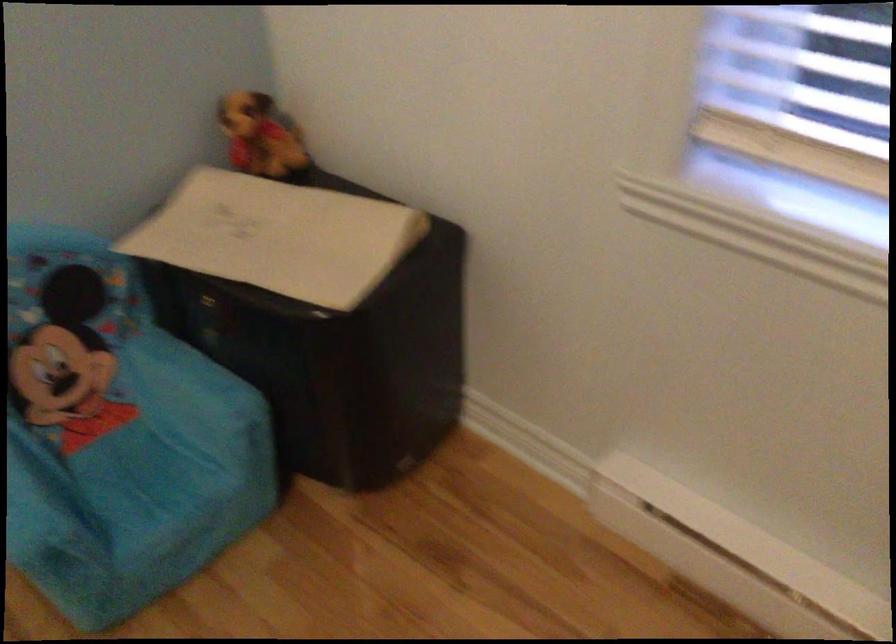
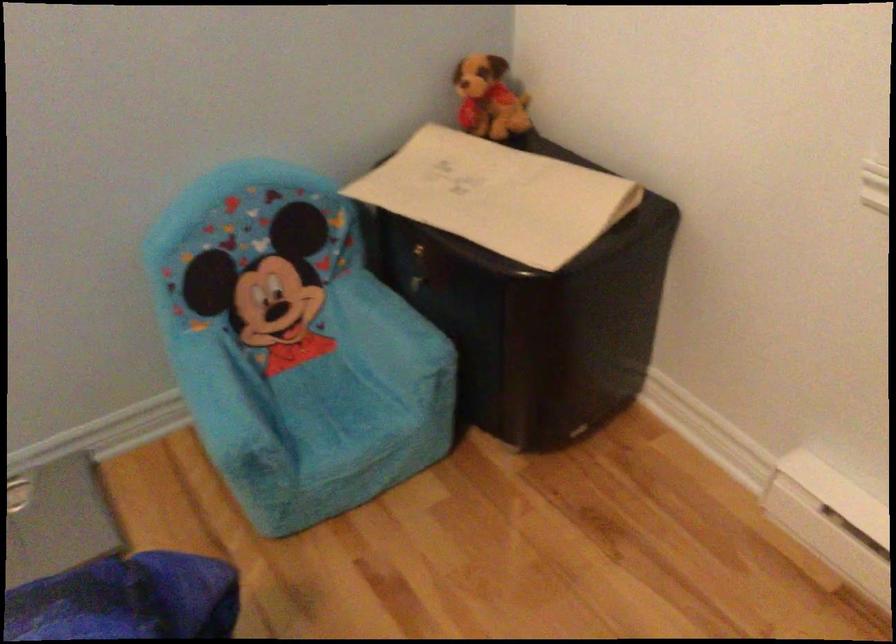
The point at [264,138] is marked in the first image. Where is the corresponding point in the second image?

(488, 99)